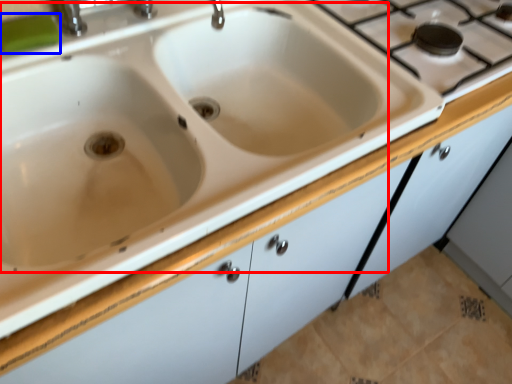
Question: Among these objects, which one is farthest to the camera, sink (highlighted by a red box) or soap (highlighted by a blue box)?

Choices:
 (A) sink
 (B) soap

Answer: (B)